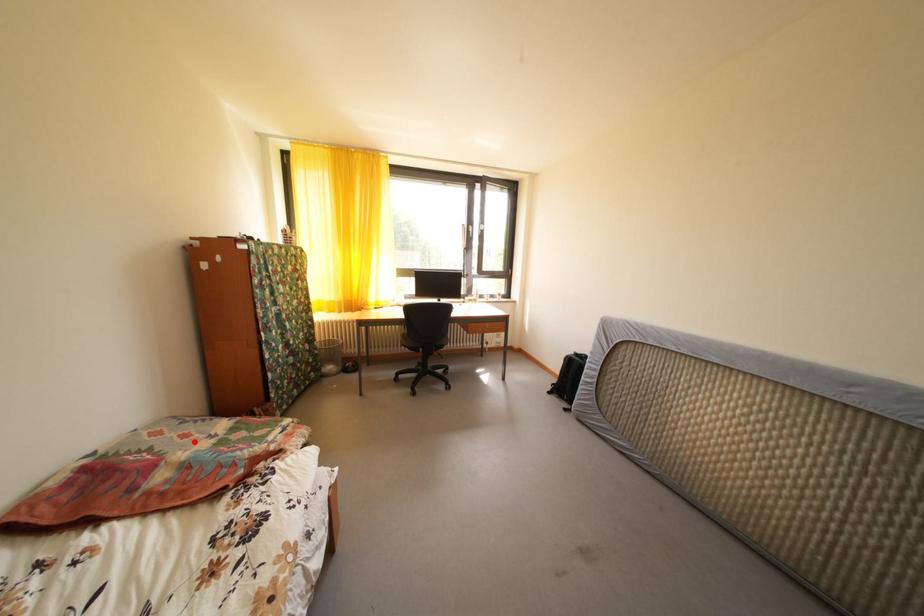
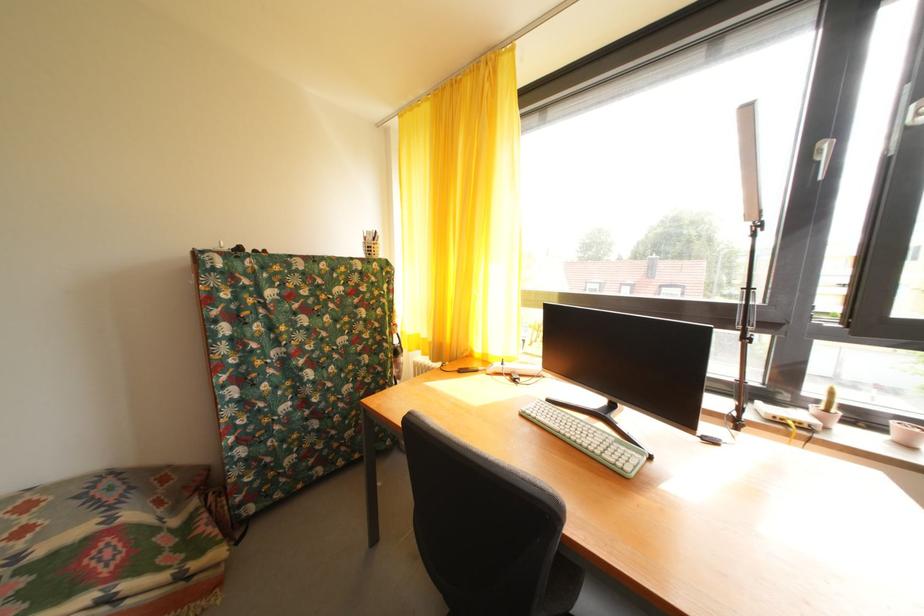
Where in the second image is the point corresponding to the highlighted location from the first image?

(31, 538)